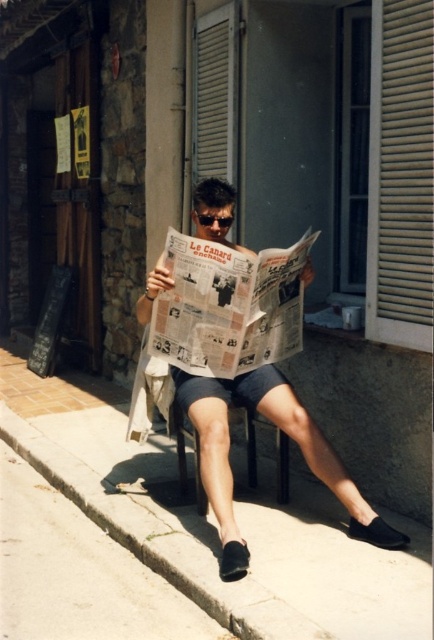
Can you confirm if concrete at lower center is taller than matte newspaper at center?

Incorrect, concrete at lower center's height is not larger of matte newspaper at center's.

Is point (283, 508) closer to camera compared to point (291, 436)?

Yes, point (283, 508) is closer to viewer.

The width and height of the screenshot is (434, 640). I want to click on concrete at lower center, so click(213, 522).